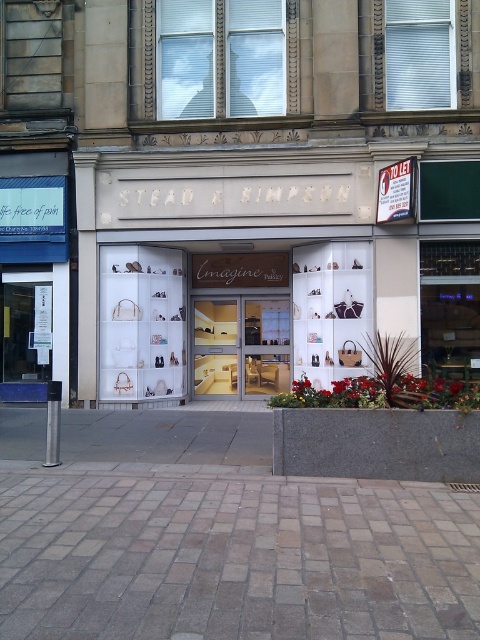
Question: Is white leather handbags at center closer to the viewer compared to matte glass window at upper center?

Choices:
 (A) yes
 (B) no

Answer: (B)

Question: Which of the following is the farthest from the observer?

Choices:
 (A) (233, 29)
 (B) (247, 481)

Answer: (A)

Question: Which point is closer to the camera taking this photo?

Choices:
 (A) [200, 300]
 (B) [285, 100]

Answer: (B)

Question: Is white leather handbags at center above matte white display case at center?

Choices:
 (A) yes
 (B) no

Answer: (A)

Question: Does white leather handbags at center have a greater width compared to matte white display case at center?

Choices:
 (A) no
 (B) yes

Answer: (B)

Question: Estimate the real-world distances between objects in this image. Which object is closer to the brown brick pavement at lower center?

Choices:
 (A) matte glass window at upper center
 (B) white leather handbags at center

Answer: (B)